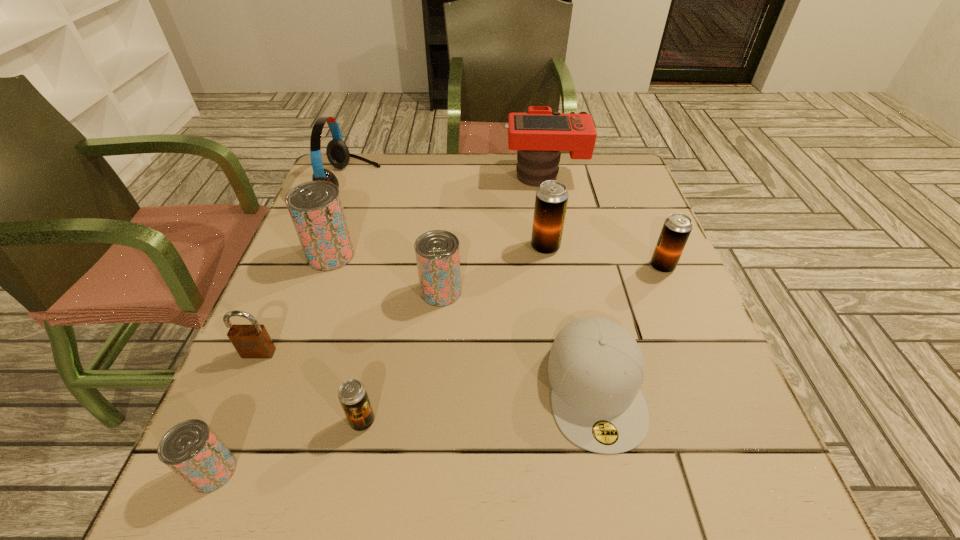
Image resolution: width=960 pixels, height=540 pixels. In order to click on cap in this screenshot , I will do `click(595, 368)`.

The height and width of the screenshot is (540, 960). What are the coordinates of `the fifth object from left to right` in the screenshot? It's located at (352, 394).

You are a GUI agent. You are given a task and a screenshot of the screen. Output one action in this format:
    pyautogui.click(x=<x>, y=<y>)
    Task: Click on the fifth farthest beer can
    
    Given the screenshot: What is the action you would take?
    pyautogui.click(x=352, y=394)

Find the location of a particular element. the smallest red beer can is located at coordinates 190,449.

Where is `the nearest red beer can`? The height and width of the screenshot is (540, 960). the nearest red beer can is located at coordinates [190, 449].

Locate an element on the screen. This screenshot has height=540, width=960. free space located 0.160m with the microphone attached to the side of the headset is located at coordinates (434, 181).

Identify the location of vacant area situated 0.140m on the left of the camera. (454, 174).

Find the location of a particular element. free space located 0.180m on the back of the farthest black beer can is located at coordinates (537, 194).

Find the location of a particular element. Image resolution: width=960 pixels, height=540 pixels. free space located on the right of the biggest red beer can is located at coordinates click(x=507, y=255).

Locate an element on the screen. free space located on the left of the second biggest black beer can is located at coordinates (502, 267).